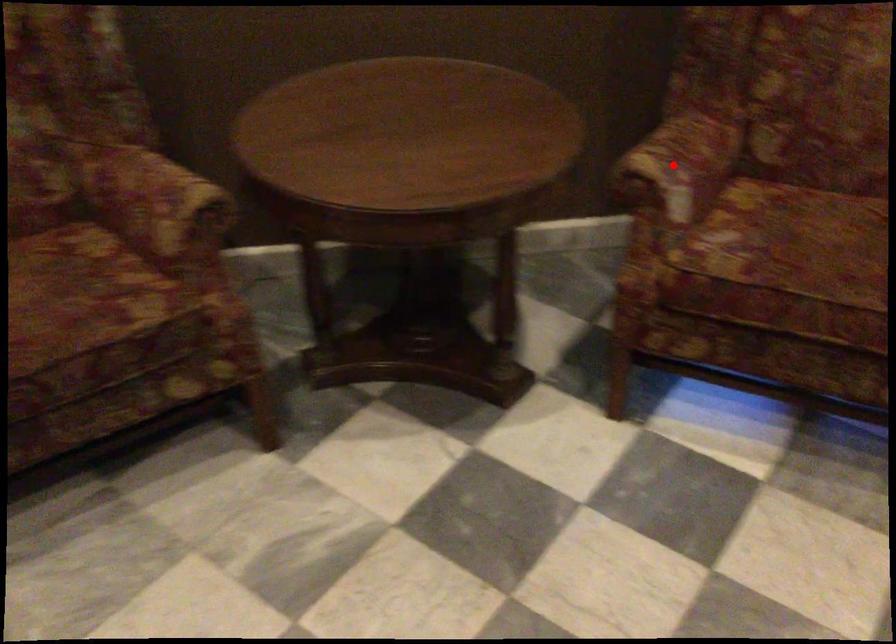
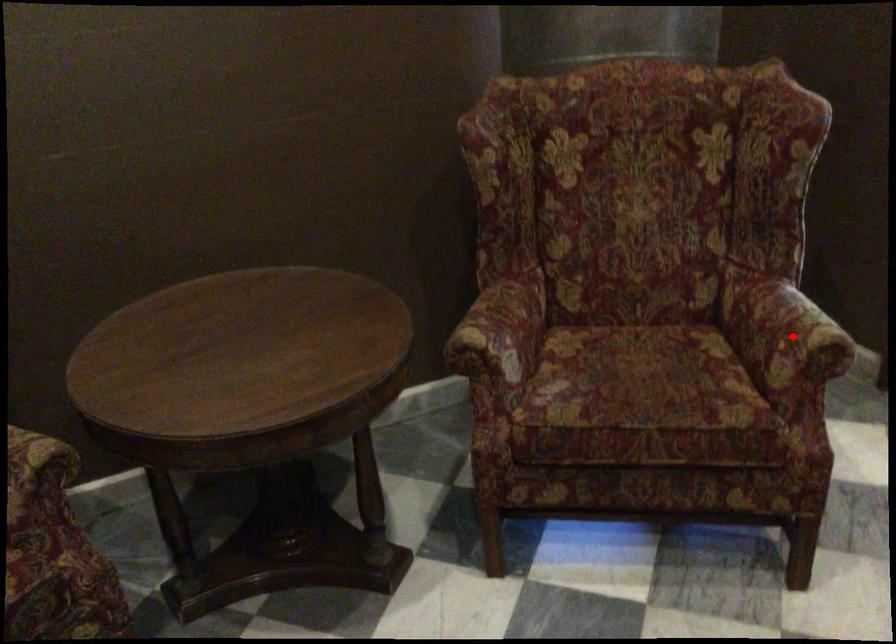
I am providing you with two images of the same scene from different viewpoints. A red point is marked on the first image and another point is marked on the second image. Is the marked point in image1 the same physical position as the marked point in image2?

No